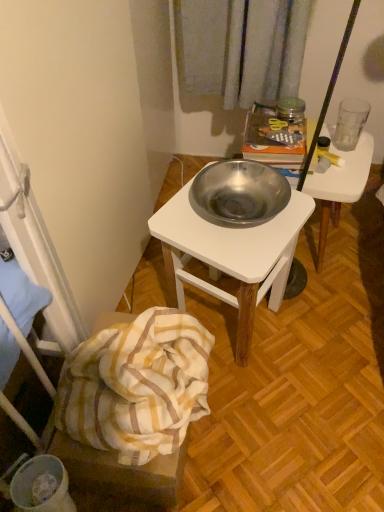
This screenshot has height=512, width=384. What do you see at coordinates (350, 123) in the screenshot? I see `transparent glass at upper right` at bounding box center [350, 123].

Describe the element at coordinates (230, 256) in the screenshot. Image resolution: width=384 pixels, height=512 pixels. I see `polished stainless steel bowl at center, which is the second desk in right-to-left order` at that location.

Find the location of a particular element. The height and width of the screenshot is (512, 384). white striped fabric at lower left is located at coordinates (112, 468).

Is metallic white desk at center, marked as the first desk in a right-to-left arrangement, looking in the opposite direction of polished stainless steel bowl at center, positioned as the 1th desk in left-to-right order?

metallic white desk at center, marked as the first desk in a right-to-left arrangement, does not have its back to polished stainless steel bowl at center, positioned as the 1th desk in left-to-right order.

Is metallic white desk at center, marked as the first desk in a right-to-left arrangement, touching polished stainless steel bowl at center, positioned as the 1th desk in left-to-right order?

No, metallic white desk at center, marked as the first desk in a right-to-left arrangement, is not next to polished stainless steel bowl at center, positioned as the 1th desk in left-to-right order.

From the image's perspective, is metallic white desk at center, marked as the first desk in a right-to-left arrangement, below polished stainless steel bowl at center, which is the second desk in right-to-left order?

No, from the image's perspective, metallic white desk at center, marked as the first desk in a right-to-left arrangement, is not beneath polished stainless steel bowl at center, which is the second desk in right-to-left order.

Considering the positions of point (294, 156) and point (219, 263), is point (294, 156) closer or farther from the camera than point (219, 263)?

Point (294, 156) appears to be farther away from the viewer than point (219, 263).

Could you tell me if white striped fabric at lower left is facing polished stainless steel bowl at center, positioned as the 1th desk in left-to-right order?

No, white striped fabric at lower left is not turned towards polished stainless steel bowl at center, positioned as the 1th desk in left-to-right order.

Considering the sizes of white striped fabric at lower left and polished stainless steel bowl at center, which is the second desk in right-to-left order, in the image, is white striped fabric at lower left taller or shorter than polished stainless steel bowl at center, which is the second desk in right-to-left order,?

In the image, white striped fabric at lower left appears to be shorter than polished stainless steel bowl at center, which is the second desk in right-to-left order.

In order to click on the 1st desk above when counting from the white striped fabric at lower left (from the image's perspective) in this screenshot , I will do `click(230, 256)`.

How far apart are white striped fabric at lower left and polished stainless steel bowl at center, positioned as the 1th desk in left-to-right order?

A distance of 13.97 inches exists between white striped fabric at lower left and polished stainless steel bowl at center, positioned as the 1th desk in left-to-right order.

Considering the points (271, 260) and (99, 329), which point is in front, point (271, 260) or point (99, 329)?

The point (271, 260) is closer to the camera.

Are polished stainless steel bowl at center, positioned as the 1th desk in left-to-right order, and white striped fabric at lower left beside each other?

No, polished stainless steel bowl at center, positioned as the 1th desk in left-to-right order, is not with white striped fabric at lower left.

Considering the sizes of objects polished stainless steel bowl at center, positioned as the 1th desk in left-to-right order, and white striped fabric at lower left in the image provided, who is taller, polished stainless steel bowl at center, positioned as the 1th desk in left-to-right order, or white striped fabric at lower left?

polished stainless steel bowl at center, positioned as the 1th desk in left-to-right order.

From a real-world perspective, is polished stainless steel bowl at center, positioned as the 1th desk in left-to-right order, physically located above or below white striped fabric at lower left?

In terms of real-world spatial position, polished stainless steel bowl at center, positioned as the 1th desk in left-to-right order, is above white striped fabric at lower left.

Considering the relative sizes of metallic white desk at center, marked as the first desk in a right-to-left arrangement, and white striped fabric at lower left in the image provided, is metallic white desk at center, marked as the first desk in a right-to-left arrangement, shorter than white striped fabric at lower left?

In fact, metallic white desk at center, marked as the first desk in a right-to-left arrangement, may be taller than white striped fabric at lower left.

Does metallic white desk at center, which is the 2th desk from left to right, turn towards white striped fabric at lower left?

No, metallic white desk at center, which is the 2th desk from left to right, does not turn towards white striped fabric at lower left.

From the picture: Between metallic white desk at center, which is the 2th desk from left to right, and white striped fabric at lower left, which one appears on the left side from the viewer's perspective?

white striped fabric at lower left.

From a real-world perspective, which is physically above, polished stainless steel bowl at center, which is the second desk in right-to-left order, or transparent glass at upper right?

In real-world perspective, transparent glass at upper right is above.

From the image's perspective, which is below, polished stainless steel bowl at center, which is the second desk in right-to-left order, or transparent glass at upper right?

From the image's view, polished stainless steel bowl at center, which is the second desk in right-to-left order, is below.

Which is behind, polished stainless steel bowl at center, which is the second desk in right-to-left order, or transparent glass at upper right?

transparent glass at upper right.

Is polished stainless steel bowl at center, which is the second desk in right-to-left order, far from metallic white desk at center, marked as the first desk in a right-to-left arrangement?

No, polished stainless steel bowl at center, which is the second desk in right-to-left order, is not far away from metallic white desk at center, marked as the first desk in a right-to-left arrangement.

Measure the distance between polished stainless steel bowl at center, positioned as the 1th desk in left-to-right order, and metallic white desk at center, marked as the first desk in a right-to-left arrangement.

A distance of 11.63 inches exists between polished stainless steel bowl at center, positioned as the 1th desk in left-to-right order, and metallic white desk at center, marked as the first desk in a right-to-left arrangement.

Considering the relative sizes of polished stainless steel bowl at center, which is the second desk in right-to-left order, and metallic white desk at center, marked as the first desk in a right-to-left arrangement, in the image provided, is polished stainless steel bowl at center, which is the second desk in right-to-left order, shorter than metallic white desk at center, marked as the first desk in a right-to-left arrangement,?

Result: No, polished stainless steel bowl at center, which is the second desk in right-to-left order, is not shorter than metallic white desk at center, marked as the first desk in a right-to-left arrangement.

Based on the photo, how many degrees apart are the facing directions of polished stainless steel bowl at center, positioned as the 1th desk in left-to-right order, and metallic white desk at center, marked as the first desk in a right-to-left arrangement?

12.9 degrees.

How distant is transparent glass at upper right from polished stainless steel bowl at center, which is the second desk in right-to-left order?

transparent glass at upper right and polished stainless steel bowl at center, which is the second desk in right-to-left order, are 21.73 inches apart from each other.

From the image's perspective, would you say transparent glass at upper right is positioned over polished stainless steel bowl at center, positioned as the 1th desk in left-to-right order?

Yes.

Which is behind, point (363, 125) or point (273, 260)?

The point (363, 125) is behind.

Which is correct: transparent glass at upper right is inside polished stainless steel bowl at center, which is the second desk in right-to-left order, or outside of it?

transparent glass at upper right is spatially situated outside polished stainless steel bowl at center, which is the second desk in right-to-left order.

Where is `desk below the polished stainless steel bowl at center, which is the second desk in right-to-left order (from a real-world perspective)`? The image size is (384, 512). desk below the polished stainless steel bowl at center, which is the second desk in right-to-left order (from a real-world perspective) is located at coordinates (339, 186).

The width and height of the screenshot is (384, 512). Identify the location of the 1st desk positioned above the white striped fabric at lower left (from the image's perspective). point(230,256).

Based on their spatial positions, is polished stainless steel bowl at center, which is the second desk in right-to-left order, or transparent glass at upper right further from white striped fabric at lower left?

transparent glass at upper right is further to white striped fabric at lower left.

Considering their positions, is polished stainless steel bowl at center, positioned as the 1th desk in left-to-right order, positioned closer to metallic white desk at center, marked as the first desk in a right-to-left arrangement, than transparent glass at upper right?

transparent glass at upper right is positioned closer to the anchor metallic white desk at center, marked as the first desk in a right-to-left arrangement.

Looking at the image, which one is located closer to metallic white desk at center, marked as the first desk in a right-to-left arrangement, white striped fabric at lower left or transparent glass at upper right?

The object closer to metallic white desk at center, marked as the first desk in a right-to-left arrangement, is transparent glass at upper right.

Which object lies further to the anchor point transparent glass at upper right, polished stainless steel bowl at center, which is the second desk in right-to-left order, or white striped fabric at lower left?

Based on the image, white striped fabric at lower left appears to be further to transparent glass at upper right.

Estimate the real-world distances between objects in this image. Which object is further from polished stainless steel bowl at center, which is the second desk in right-to-left order, metallic white desk at center, marked as the first desk in a right-to-left arrangement, or transparent glass at upper right?

transparent glass at upper right.

Which object lies further to the anchor point metallic white desk at center, marked as the first desk in a right-to-left arrangement, white striped fabric at lower left or polished stainless steel bowl at center, positioned as the 1th desk in left-to-right order?

Among the two, white striped fabric at lower left is located further to metallic white desk at center, marked as the first desk in a right-to-left arrangement.

When comparing their distances from polished stainless steel bowl at center, which is the second desk in right-to-left order, does white striped fabric at lower left or transparent glass at upper right seem closer?

white striped fabric at lower left lies closer to polished stainless steel bowl at center, which is the second desk in right-to-left order, than the other object.

Based on their spatial positions, is polished stainless steel bowl at center, positioned as the 1th desk in left-to-right order, or metallic white desk at center, marked as the first desk in a right-to-left arrangement, closer to white striped fabric at lower left?

polished stainless steel bowl at center, positioned as the 1th desk in left-to-right order, is positioned closer to the anchor white striped fabric at lower left.

Where is `desk between white striped fabric at lower left and metallic white desk at center, marked as the first desk in a right-to-left arrangement, in the horizontal direction`? The image size is (384, 512). desk between white striped fabric at lower left and metallic white desk at center, marked as the first desk in a right-to-left arrangement, in the horizontal direction is located at coordinates (230, 256).

The height and width of the screenshot is (512, 384). Identify the location of desk between transparent glass at upper right and polished stainless steel bowl at center, which is the second desk in right-to-left order, from top to bottom. (339, 186).